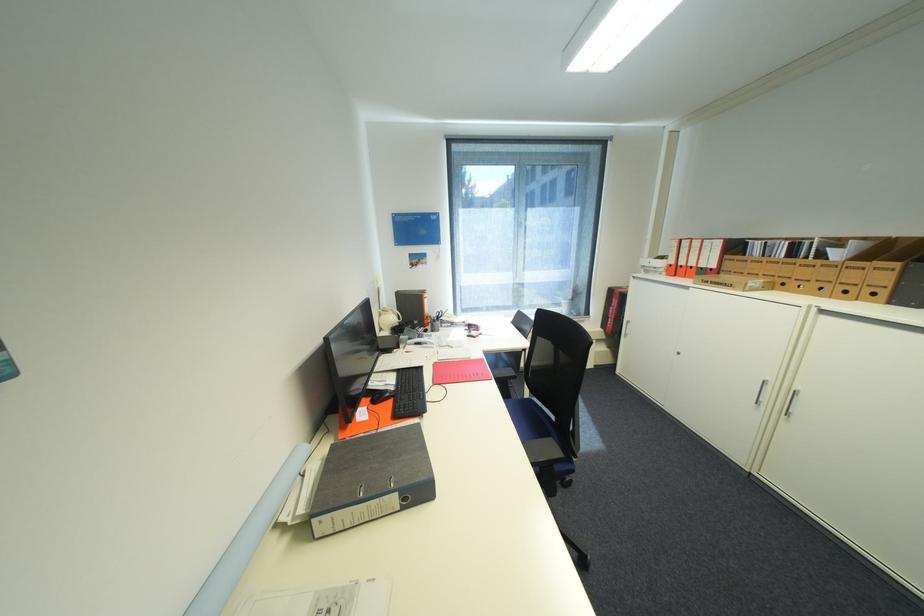
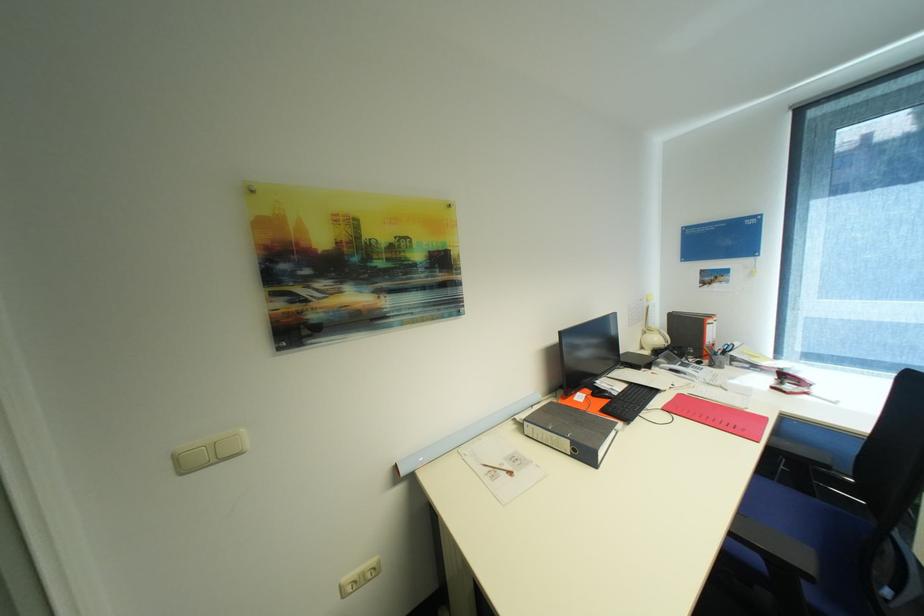
The point at (481, 334) is marked in the first image. Where is the corresponding point in the second image?

(796, 387)